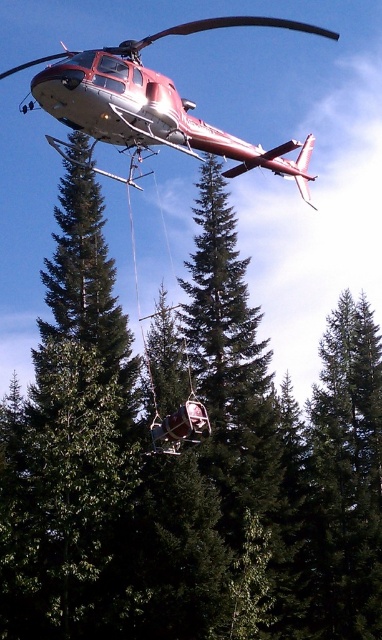
Does green textured tree at center appear on the right side of metallic silver ski lift at center?

Incorrect, green textured tree at center is not on the right side of metallic silver ski lift at center.

In the scene shown: Is green textured tree at center shorter than metallic silver ski lift at center?

In fact, green textured tree at center may be taller than metallic silver ski lift at center.

Who is more forward, (29, 477) or (160, 419)?

Point (160, 419) is more forward.

You are a GUI agent. You are given a task and a screenshot of the screen. Output one action in this format:
    pyautogui.click(x=<x>, y=<y>)
    Task: Click on the green textured tree at center
    The image size is (382, 640).
    Given the screenshot: What is the action you would take?
    pyautogui.click(x=67, y=433)

Who is shorter, metallic silver ski lift at center or metallic red chair at center?

With less height is metallic red chair at center.

Is point (179, 424) positioned before point (178, 452)?

Yes.

Who is more forward, (157, 442) or (153, 428)?

Point (157, 442) is in front.

The image size is (382, 640). I want to click on metallic silver ski lift at center, so click(x=176, y=417).

Can you confirm if metallic red helicopter at upper center is positioned above metallic silver ski lift at center?

Correct, metallic red helicopter at upper center is located above metallic silver ski lift at center.

Does point (105, 92) come farther from viewer compared to point (168, 438)?

No, it is not.

Where is `metallic red helicopter at upper center`? This screenshot has height=640, width=382. metallic red helicopter at upper center is located at coordinates (155, 104).